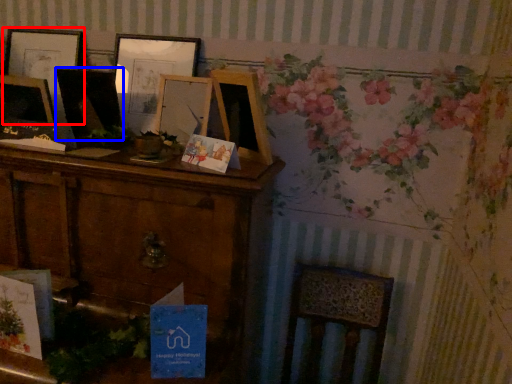
Question: Which object is further to the camera taking this photo, picture frame (highlighted by a red box) or picture frame (highlighted by a blue box)?

Choices:
 (A) picture frame
 (B) picture frame

Answer: (A)